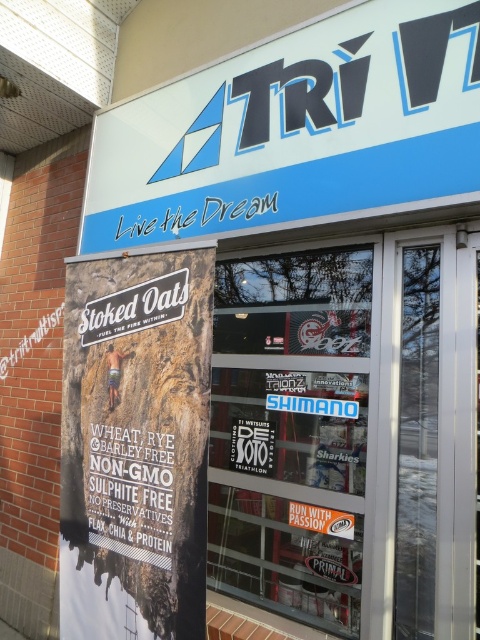
Question: Does blue plastic sign at upper center appear on the right side of matte black sign at center?

Choices:
 (A) yes
 (B) no

Answer: (B)

Question: Is matte paper poster at left in front of matte black sign at center?

Choices:
 (A) no
 (B) yes

Answer: (B)

Question: Where is blue plastic sign at upper center located in relation to matte black sign at center in the image?

Choices:
 (A) above
 (B) below

Answer: (A)

Question: Which point is farther to the camera?

Choices:
 (A) (145, 195)
 (B) (241, 452)
 (C) (69, 497)

Answer: (A)

Question: Estimate the real-world distances between objects in this image. Which object is closer to the blue plastic sign at upper center?

Choices:
 (A) matte black sign at center
 (B) matte paper poster at left

Answer: (B)

Question: Which object is farther from the camera taking this photo?

Choices:
 (A) matte black sign at center
 (B) matte paper poster at left

Answer: (A)